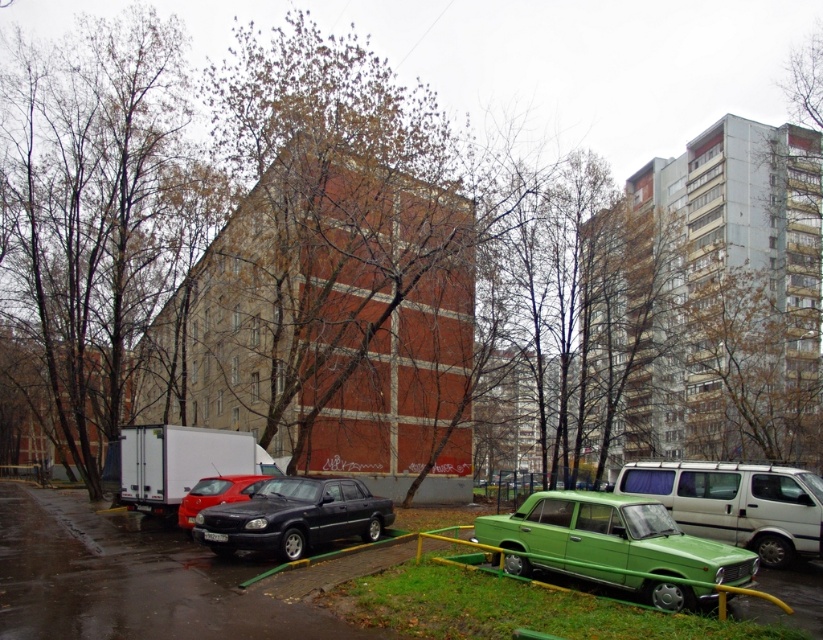
Question: Does green matte car at center come behind white matte van at center?

Choices:
 (A) yes
 (B) no

Answer: (B)

Question: Is green matte car at center to the right of shiny black sedan at center from the viewer's perspective?

Choices:
 (A) yes
 (B) no

Answer: (B)

Question: Does white matte van at center have a greater width compared to shiny black sedan at center?

Choices:
 (A) yes
 (B) no

Answer: (A)

Question: Which object is positioned closest to the white matte van at center?

Choices:
 (A) shiny black sedan at center
 (B) metallic silver minivan at center
 (C) shiny red sedan at center

Answer: (B)

Question: Which of the following is the closest to the observer?

Choices:
 (A) shiny red sedan at center
 (B) green matte car at center

Answer: (B)

Question: Which of the following is the farthest from the observer?

Choices:
 (A) (580, 490)
 (B) (240, 477)
 (C) (54, 566)

Answer: (B)